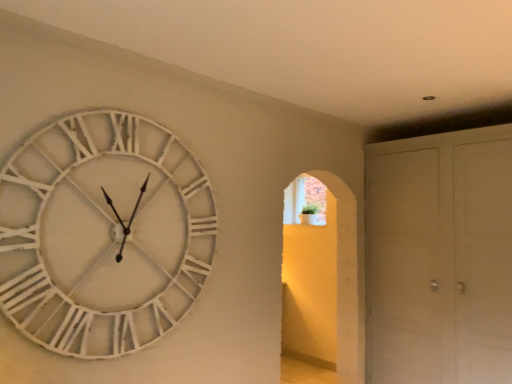
Question: Considering the positions of point (435, 281) and point (140, 309), is point (435, 281) closer or farther from the camera than point (140, 309)?

Choices:
 (A) farther
 (B) closer

Answer: (A)

Question: From the image's perspective, is white matte cabinet at right positioned above or below white wooden clock at upper left?

Choices:
 (A) below
 (B) above

Answer: (A)

Question: Would you say white matte cabinet at right is inside or outside white wooden clock at upper left?

Choices:
 (A) inside
 (B) outside

Answer: (B)

Question: In terms of height, does white wooden clock at upper left look taller or shorter compared to white matte cabinet at right?

Choices:
 (A) short
 (B) tall

Answer: (A)

Question: From a real-world perspective, is white wooden clock at upper left positioned above or below white matte cabinet at right?

Choices:
 (A) below
 (B) above

Answer: (B)

Question: Considering their positions, is white wooden clock at upper left located in front of or behind white matte cabinet at right?

Choices:
 (A) behind
 (B) front

Answer: (B)

Question: From the image's perspective, is white wooden clock at upper left above or below white matte cabinet at right?

Choices:
 (A) above
 (B) below

Answer: (A)